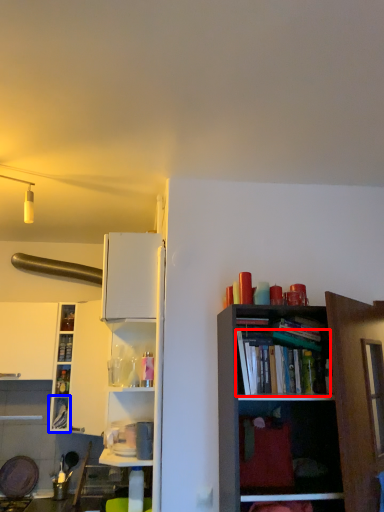
Question: Which of the following is the farthest to the observer, book (highlighted by a red box) or cabinet (highlighted by a blue box)?

Choices:
 (A) book
 (B) cabinet

Answer: (B)